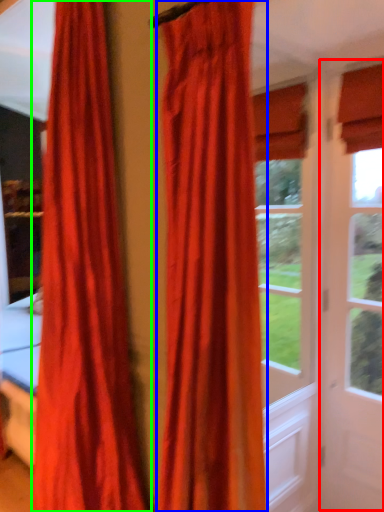
Question: Based on their relative distances, which object is farther from screen door (highlighted by a red box)? Choose from curtain (highlighted by a blue box) and curtain (highlighted by a green box).

Choices:
 (A) curtain
 (B) curtain

Answer: (B)